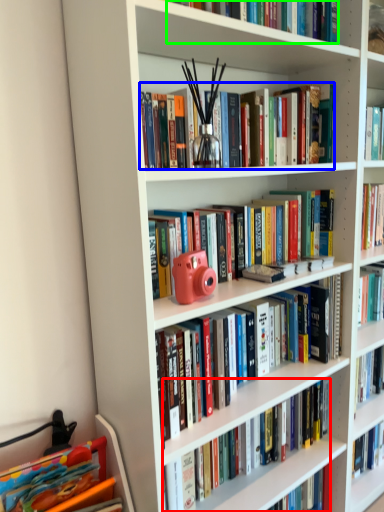
Question: Estimate the real-world distances between objects in this image. Which object is farther from book (highlighted by a red box), book (highlighted by a blue box) or book (highlighted by a green box)?

Choices:
 (A) book
 (B) book

Answer: (B)